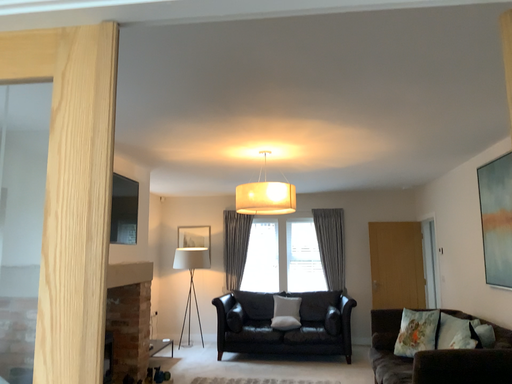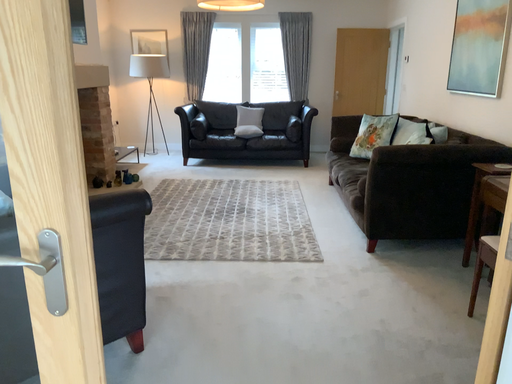
Question: How did the camera likely rotate when shooting the video?

Choices:
 (A) rotated upward
 (B) rotated downward

Answer: (B)